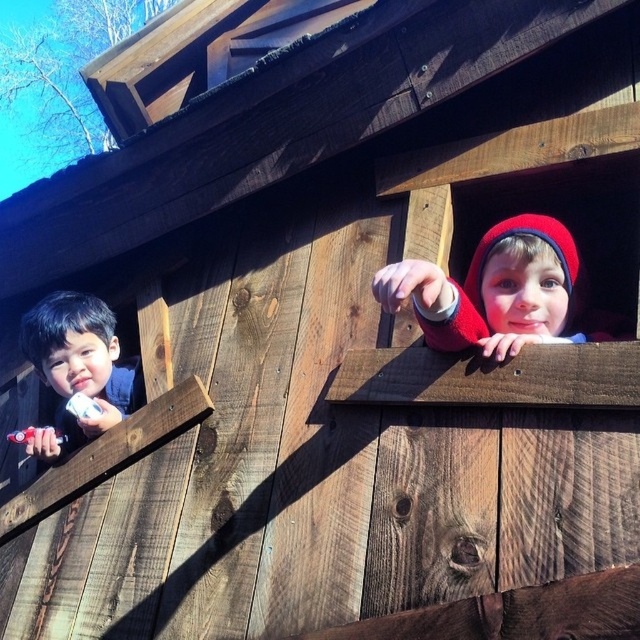
Question: Considering the real-world distances, which object is farthest from the pink matte lips at upper center?

Choices:
 (A) smooth skin boy at left
 (B) red knit hat at upper right

Answer: (A)

Question: Which point is farther from the camera taking this photo?

Choices:
 (A) (81, 388)
 (B) (557, 289)
 (C) (545, 328)
 (D) (64, 321)

Answer: (A)

Question: Where is pink matte lips at upper center located in relation to matte white toothbrush at left in the image?

Choices:
 (A) left
 (B) right

Answer: (B)

Question: Is the position of pink matte lips at upper center more distant than that of matte white toothbrush at left?

Choices:
 (A) yes
 (B) no

Answer: (B)

Question: Does smooth skin boy at left have a larger size compared to matte white toothbrush at left?

Choices:
 (A) no
 (B) yes

Answer: (B)

Question: Which point appears closest to the camera in this image?

Choices:
 (A) (545, 243)
 (B) (529, 317)
 (C) (77, 374)

Answer: (B)